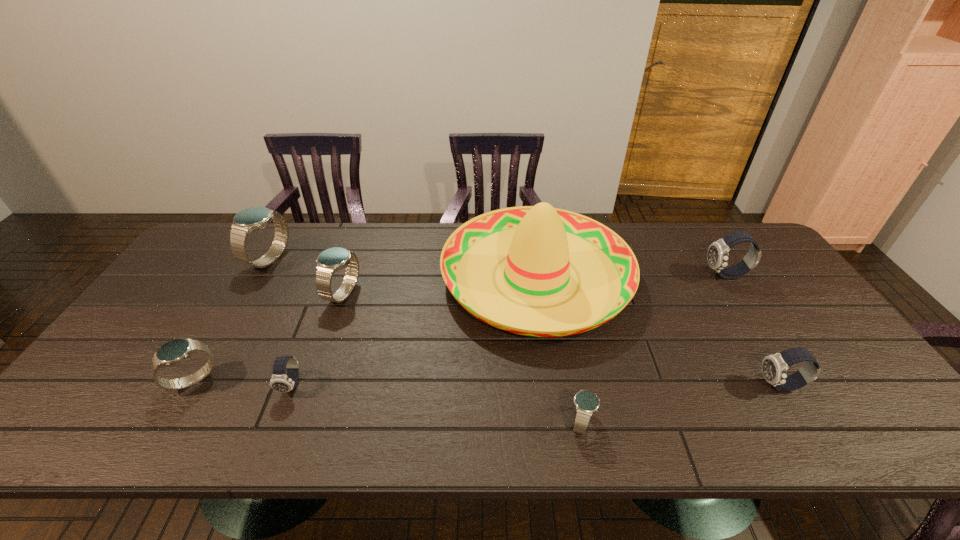
At what (x,y) coordinates should I click in order to perform the action: click on free space between the second blue watch from right to left and the second smallest blue watch. Please return your answer as a coordinate pair (x, y). Image resolution: width=960 pixels, height=540 pixels. Looking at the image, I should click on (268, 337).

The width and height of the screenshot is (960, 540). Find the location of `vacant space that is in between the third blue watch from left to right and the red sombrero`. vacant space that is in between the third blue watch from left to right and the red sombrero is located at coordinates (440, 286).

You are a GUI agent. You are given a task and a screenshot of the screen. Output one action in this format:
    pyautogui.click(x=<x>, y=<y>)
    Task: Click on the free space that is in between the smallest dark watch and the second blue watch from right to left
    
    Given the screenshot: What is the action you would take?
    pyautogui.click(x=317, y=340)

The width and height of the screenshot is (960, 540). What are the coordinates of `free space that is in between the third biggest blue watch and the second smallest dark watch` in the screenshot? It's located at (487, 383).

Locate an element on the screen. This screenshot has width=960, height=540. free space between the farthest dark watch and the biggest blue watch is located at coordinates (497, 267).

I want to click on empty space that is in between the third farthest blue watch and the second smallest dark watch, so click(x=487, y=383).

Where is `vacant space in between the rightmost blue watch and the third blue watch from left to right`? The width and height of the screenshot is (960, 540). vacant space in between the rightmost blue watch and the third blue watch from left to right is located at coordinates (462, 358).

Locate an element on the screen. vacant region between the second smallest blue watch and the leftmost dark watch is located at coordinates 243,382.

The width and height of the screenshot is (960, 540). Find the location of `free spot between the third smallest blue watch and the biggest blue watch`. free spot between the third smallest blue watch and the biggest blue watch is located at coordinates (306, 277).

Choose which object is the second nearest neighbor to the biggest blue watch. Please provide its 2D coordinates. Your answer should be formatted as a tuple, i.e. [(x, y)], where the tuple contains the x and y coordinates of a point satisfying the conditions above.

[(175, 351)]